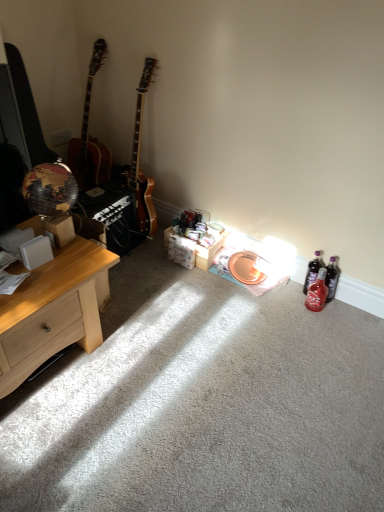
What do you see at coordinates (313, 270) in the screenshot?
I see `translucent purple bottle at lower right, which is the 2th bottle in front-to-back order` at bounding box center [313, 270].

You are a GUI agent. You are given a task and a screenshot of the screen. Output one action in this format:
    pyautogui.click(x=<x>, y=<y>)
    Task: Click on the translucent purple bottle at lower right, which is the 2th bottle in front-to-back order
    
    Given the screenshot: What is the action you would take?
    pyautogui.click(x=313, y=270)

What's the angular difference between light wood desk at left and white cardboard box at center's facing directions?

They differ by 88.4 degrees in their facing directions.

In terms of width, does light wood desk at left look wider or thinner when compared to white cardboard box at center?

light wood desk at left is wider than white cardboard box at center.

Does light wood desk at left have a larger size compared to white cardboard box at center?

Indeed, light wood desk at left has a larger size compared to white cardboard box at center.

Is light wood desk at left next to white cardboard box at center and touching it?

No, light wood desk at left is not beside white cardboard box at center.

Can you tell me how much white cardboard box at center and light wood desk at left differ in facing direction?

The angular difference between white cardboard box at center and light wood desk at left is 88.4 degrees.

Identify the location of desk that appears in front of the white cardboard box at center. (54, 310).

From a real-world perspective, relative to light wood desk at left, is white cardboard box at center vertically above or below?

white cardboard box at center is below light wood desk at left.

Is point (171, 234) positioned in front of point (98, 334)?

No, it is not.

The width and height of the screenshot is (384, 512). In order to click on bottle behind the translucent red glass bottle at lower right, the first bottle viewed from the front in this screenshot , I will do `click(313, 270)`.

How many degrees apart are the facing directions of translucent purple bottle at lower right, which is the 2th bottle in front-to-back order, and translucent red glass bottle at lower right, acting as the 2th bottle starting from the back?

They differ by 0.206 degrees in their facing directions.

In the scene shown: Is translucent purple bottle at lower right, which is the 2th bottle in front-to-back order, bigger or smaller than translucent red glass bottle at lower right, acting as the 2th bottle starting from the back?

Considering their sizes, translucent purple bottle at lower right, which is the 2th bottle in front-to-back order, takes up less space than translucent red glass bottle at lower right, acting as the 2th bottle starting from the back.

Can you confirm if translucent purple bottle at lower right, which is the 2th bottle in front-to-back order, is taller than translucent red glass bottle at lower right, the first bottle viewed from the front?

Indeed, translucent purple bottle at lower right, which is the 2th bottle in front-to-back order, has a greater height compared to translucent red glass bottle at lower right, the first bottle viewed from the front.

Considering the positions of objects translucent purple bottle at lower right, which appears as the first bottle when viewed from the back, and light wood desk at left in the image provided, who is more to the left, translucent purple bottle at lower right, which appears as the first bottle when viewed from the back, or light wood desk at left?

Positioned to the left is light wood desk at left.

Who is shorter, translucent purple bottle at lower right, which appears as the first bottle when viewed from the back, or light wood desk at left?

Standing shorter between the two is translucent purple bottle at lower right, which appears as the first bottle when viewed from the back.

Between translucent purple bottle at lower right, which appears as the first bottle when viewed from the back, and light wood desk at left, which one has larger width?

With larger width is light wood desk at left.

Considering the positions of points (321, 250) and (38, 284), is point (321, 250) closer to camera compared to point (38, 284)?

No, it is behind (38, 284).

Consider the image. Does translucent red glass bottle at lower right, acting as the 2th bottle starting from the back, have a greater height compared to light wood desk at left?

No.

From a real-world perspective, is translucent red glass bottle at lower right, acting as the 2th bottle starting from the back, located beneath light wood desk at left?

Indeed, from a real-world perspective, translucent red glass bottle at lower right, acting as the 2th bottle starting from the back, is positioned beneath light wood desk at left.

How different are the orientations of translucent red glass bottle at lower right, acting as the 2th bottle starting from the back, and light wood desk at left in degrees?

The facing directions of translucent red glass bottle at lower right, acting as the 2th bottle starting from the back, and light wood desk at left are 90.4 degrees apart.

Is point (319, 280) positioned before point (206, 247)?

Yes, it is.

Is translucent red glass bottle at lower right, the first bottle viewed from the front, directly adjacent to white cardboard box at center?

They are not placed beside each other.

From the image's perspective, which one is positioned higher, translucent red glass bottle at lower right, the first bottle viewed from the front, or white cardboard box at center?

white cardboard box at center, from the image's perspective.

Considering the sizes of white cardboard box at center and translucent red glass bottle at lower right, acting as the 2th bottle starting from the back, in the image, is white cardboard box at center bigger or smaller than translucent red glass bottle at lower right, acting as the 2th bottle starting from the back,?

white cardboard box at center is bigger than translucent red glass bottle at lower right, acting as the 2th bottle starting from the back.

Is white cardboard box at center touching translucent red glass bottle at lower right, the first bottle viewed from the front?

No, white cardboard box at center is not beside translucent red glass bottle at lower right, the first bottle viewed from the front.

Considering the relative positions of white cardboard box at center and translucent red glass bottle at lower right, acting as the 2th bottle starting from the back, in the image provided, is white cardboard box at center behind translucent red glass bottle at lower right, acting as the 2th bottle starting from the back,?

Yes, white cardboard box at center is further from the camera.

Locate an element on the screen. The width and height of the screenshot is (384, 512). desk in front of the white cardboard box at center is located at coordinates (54, 310).

In order to click on box located behind the light wood desk at left in this screenshot , I will do (193, 250).

Estimate the real-world distances between objects in this image. Which object is closer to translucent red glass bottle at lower right, acting as the 2th bottle starting from the back, white cardboard box at center or translucent purple bottle at lower right, which appears as the first bottle when viewed from the back?

Among the two, translucent purple bottle at lower right, which appears as the first bottle when viewed from the back, is located nearer to translucent red glass bottle at lower right, acting as the 2th bottle starting from the back.

From the picture: Based on their spatial positions, is white cardboard box at center or translucent red glass bottle at lower right, acting as the 2th bottle starting from the back, further from light wood desk at left?

translucent red glass bottle at lower right, acting as the 2th bottle starting from the back, is positioned further to the anchor light wood desk at left.

Considering their positions, is light wood desk at left positioned further to white cardboard box at center than translucent red glass bottle at lower right, the first bottle viewed from the front?

The object further to white cardboard box at center is light wood desk at left.

Based on their spatial positions, is translucent purple bottle at lower right, which appears as the first bottle when viewed from the back, or light wood desk at left further from translucent red glass bottle at lower right, acting as the 2th bottle starting from the back?

Based on the image, light wood desk at left appears to be further to translucent red glass bottle at lower right, acting as the 2th bottle starting from the back.

Considering their positions, is white cardboard box at center positioned further to light wood desk at left than translucent purple bottle at lower right, which is the 2th bottle in front-to-back order?

translucent purple bottle at lower right, which is the 2th bottle in front-to-back order.

Considering their positions, is light wood desk at left positioned further to translucent red glass bottle at lower right, the first bottle viewed from the front, than white cardboard box at center?

light wood desk at left is positioned further to the anchor translucent red glass bottle at lower right, the first bottle viewed from the front.

Which object lies further to the anchor point light wood desk at left, translucent red glass bottle at lower right, acting as the 2th bottle starting from the back, or white cardboard box at center?

translucent red glass bottle at lower right, acting as the 2th bottle starting from the back.

When comparing their distances from white cardboard box at center, does translucent purple bottle at lower right, which appears as the first bottle when viewed from the back, or translucent red glass bottle at lower right, acting as the 2th bottle starting from the back, seem closer?

translucent purple bottle at lower right, which appears as the first bottle when viewed from the back, is positioned closer to the anchor white cardboard box at center.

Where is `bottle located between light wood desk at left and translucent red glass bottle at lower right, the first bottle viewed from the front, in the left-right direction`? bottle located between light wood desk at left and translucent red glass bottle at lower right, the first bottle viewed from the front, in the left-right direction is located at coordinates (313, 270).

Where is `box between light wood desk at left and translucent red glass bottle at lower right, the first bottle viewed from the front, from left to right`? The height and width of the screenshot is (512, 384). box between light wood desk at left and translucent red glass bottle at lower right, the first bottle viewed from the front, from left to right is located at coordinates (193, 250).

The height and width of the screenshot is (512, 384). I want to click on bottle between white cardboard box at center and translucent red glass bottle at lower right, acting as the 2th bottle starting from the back, so click(313, 270).

You are a GUI agent. You are given a task and a screenshot of the screen. Output one action in this format:
    pyautogui.click(x=<x>, y=<y>)
    Task: Click on the box between light wood desk at left and translucent purple bottle at lower right, which is the 2th bottle in front-to-back order
    Image resolution: width=384 pixels, height=512 pixels.
    Given the screenshot: What is the action you would take?
    pyautogui.click(x=193, y=250)